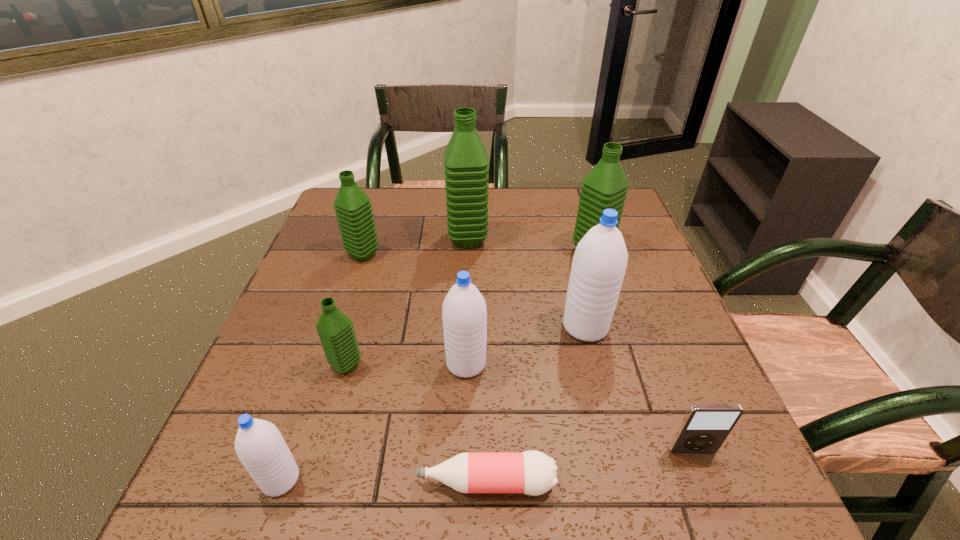
This screenshot has width=960, height=540. What are the coordinates of `blue water bottle identified as the closest to the rightmost green water bottle` in the screenshot? It's located at (599, 264).

Identify the location of blue water bottle that is the closest one to the second smallest blue water bottle. (599, 264).

You are a GUI agent. You are given a task and a screenshot of the screen. Output one action in this format:
    pyautogui.click(x=<x>, y=<y>)
    Task: Click on the vacant area in the image that satisfies the following two spatial constraints: 1. on the front side of the second blue water bottle from left to right; 2. on the right side of the tallest object
    This screenshot has height=540, width=960.
    Given the screenshot: What is the action you would take?
    pyautogui.click(x=464, y=363)